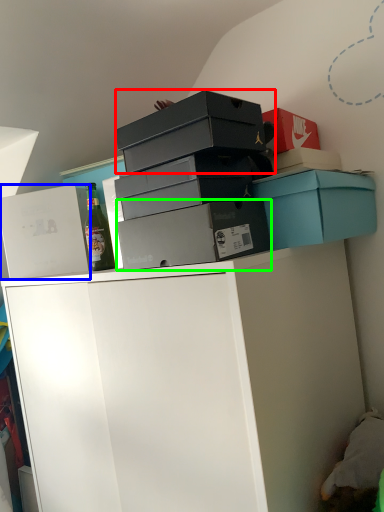
Question: Which object is the closest to the box (highlighted by a red box)? Choose among these: box (highlighted by a blue box) or box (highlighted by a green box).

Choices:
 (A) box
 (B) box

Answer: (B)